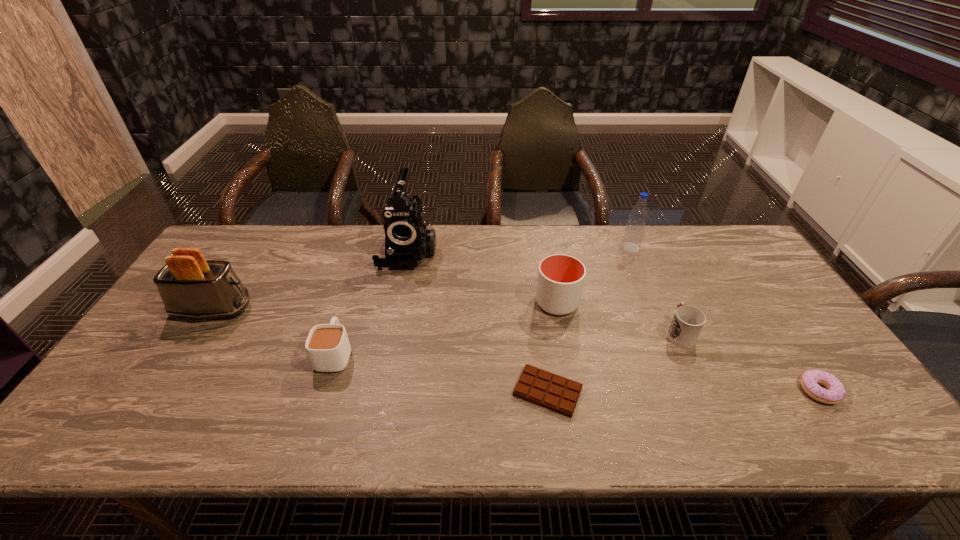
Identify the location of free space between the water bottle and the second cup from left to right. The image size is (960, 540). (593, 275).

Find the location of a particular element. This screenshot has width=960, height=540. free spot between the rightmost cup and the candy bar is located at coordinates (613, 362).

This screenshot has height=540, width=960. In order to click on vacant point located between the water bottle and the doughnut in this screenshot , I will do `click(725, 319)`.

Find the location of a particular element. The image size is (960, 540). the closest object to the camcorder is located at coordinates (327, 345).

This screenshot has height=540, width=960. I want to click on object that is the sixth nearest to the leftmost cup, so click(x=634, y=231).

Locate an element on the screen. Image resolution: width=960 pixels, height=540 pixels. cup that stands as the closest to the toaster is located at coordinates (327, 345).

Identify the location of the third closest cup to the toaster. (688, 321).

I want to click on vacant space that satisfies the following two spatial constraints: 1. on the side of the leftmost object with the control lever; 2. on the left side of the second shortest object, so click(160, 391).

You are a GUI agent. You are given a task and a screenshot of the screen. Output one action in this format:
    pyautogui.click(x=<x>, y=<y>)
    Task: Click on the vacant position in the image that satisfies the following two spatial constraints: 1. on the lens mount of the farthest cup; 2. on the right side of the camcorder
    
    Given the screenshot: What is the action you would take?
    397,302

Locate an element on the screen. The height and width of the screenshot is (540, 960). vacant space that satisfies the following two spatial constraints: 1. on the side with the handle of the leftmost cup; 2. on the right side of the tallest cup is located at coordinates pos(351,302).